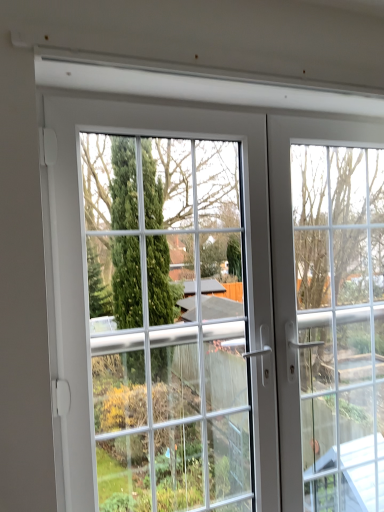
Question: From the image's perspective, would you say white glass door at center is shown under white plastic window frame at right?

Choices:
 (A) no
 (B) yes

Answer: (A)

Question: Can you confirm if white glass door at center is thinner than white plastic window frame at right?

Choices:
 (A) no
 (B) yes

Answer: (A)

Question: Considering the relative sizes of white glass door at center and white plastic window frame at right in the image provided, is white glass door at center taller than white plastic window frame at right?

Choices:
 (A) yes
 (B) no

Answer: (A)

Question: Is white glass door at center outside white plastic window frame at right?

Choices:
 (A) yes
 (B) no

Answer: (A)

Question: Can you confirm if white glass door at center is wider than white plastic window frame at right?

Choices:
 (A) no
 (B) yes

Answer: (B)

Question: From a real-world perspective, is white glass door at center located beneath white plastic window frame at right?

Choices:
 (A) yes
 (B) no

Answer: (B)

Question: Is white plastic window frame at right turned away from white glass door at center?

Choices:
 (A) yes
 (B) no

Answer: (A)

Question: Is white plastic window frame at right beside white glass door at center?

Choices:
 (A) yes
 (B) no

Answer: (B)

Question: Can you confirm if white plastic window frame at right is shorter than white glass door at center?

Choices:
 (A) no
 (B) yes

Answer: (B)

Question: Can you confirm if white plastic window frame at right is bigger than white glass door at center?

Choices:
 (A) yes
 (B) no

Answer: (B)

Question: Is white plastic window frame at right to the left of white glass door at center from the viewer's perspective?

Choices:
 (A) yes
 (B) no

Answer: (B)

Question: From a real-world perspective, is white plastic window frame at right located beneath white glass door at center?

Choices:
 (A) no
 (B) yes

Answer: (B)

Question: From the image's perspective, is white plastic window frame at right positioned above or below white glass door at center?

Choices:
 (A) below
 (B) above

Answer: (A)